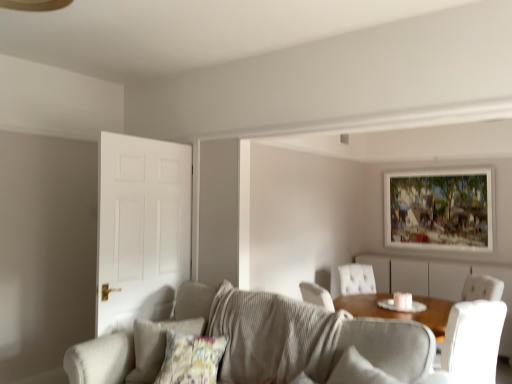
Question: Is textured gray couch at center touching wooden-framed painting at upper right?

Choices:
 (A) no
 (B) yes

Answer: (A)

Question: Is textured gray couch at center looking in the opposite direction of wooden-framed painting at upper right?

Choices:
 (A) yes
 (B) no

Answer: (A)

Question: Is textured gray couch at center positioned behind wooden-framed painting at upper right?

Choices:
 (A) yes
 (B) no

Answer: (B)

Question: Is textured gray couch at center not near wooden-framed painting at upper right?

Choices:
 (A) no
 (B) yes

Answer: (B)

Question: From a real-world perspective, is textured gray couch at center located beneath wooden-framed painting at upper right?

Choices:
 (A) yes
 (B) no

Answer: (A)

Question: Does textured gray couch at center appear on the left side of wooden-framed painting at upper right?

Choices:
 (A) yes
 (B) no

Answer: (A)

Question: Considering the relative sizes of wooden-framed painting at upper right and white matte door at left in the image provided, is wooden-framed painting at upper right smaller than white matte door at left?

Choices:
 (A) yes
 (B) no

Answer: (A)

Question: Is wooden-framed painting at upper right wider than white matte door at left?

Choices:
 (A) yes
 (B) no

Answer: (B)

Question: From the image's perspective, would you say wooden-framed painting at upper right is positioned over white matte door at left?

Choices:
 (A) no
 (B) yes

Answer: (B)

Question: From a real-world perspective, is wooden-framed painting at upper right on top of white matte door at left?

Choices:
 (A) yes
 (B) no

Answer: (A)

Question: Is wooden-framed painting at upper right thinner than white matte door at left?

Choices:
 (A) no
 (B) yes

Answer: (B)

Question: Considering the relative positions of wooden-framed painting at upper right and white matte door at left in the image provided, is wooden-framed painting at upper right to the left of white matte door at left from the viewer's perspective?

Choices:
 (A) no
 (B) yes

Answer: (A)

Question: Is the position of white matte door at left more distant than that of wooden dresser at center?

Choices:
 (A) yes
 (B) no

Answer: (B)